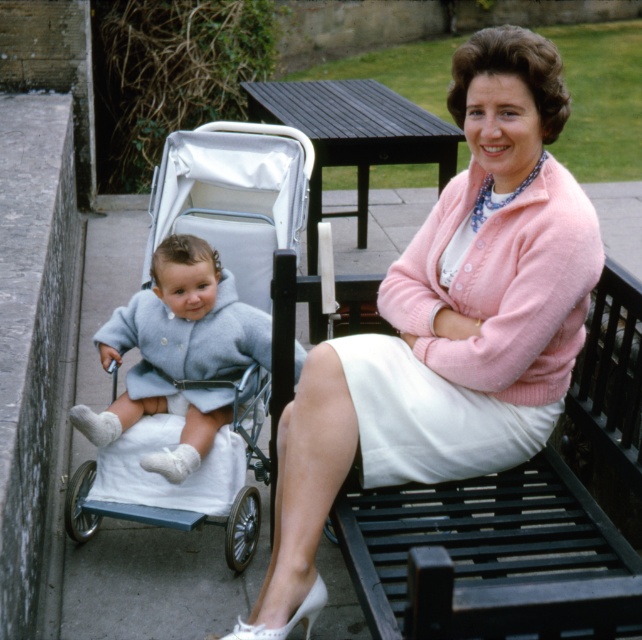
Question: Can you confirm if pink woolen cardigan at upper right is positioned to the left of black wooden bench at upper center?

Choices:
 (A) no
 (B) yes

Answer: (B)

Question: Which of these objects is positioned farthest from the white fabric skirt at center?

Choices:
 (A) black wooden bench at upper center
 (B) pink woolen cardigan at upper right
 (C) light blue fabric baby carriage at left

Answer: (C)

Question: Does light blue fabric baby carriage at left have a greater width compared to white fabric skirt at center?

Choices:
 (A) no
 (B) yes

Answer: (B)

Question: Which point is closer to the camera taking this photo?

Choices:
 (A) (525, 189)
 (B) (191, 305)

Answer: (A)

Question: Can you confirm if pink woolen cardigan at upper right is positioned below light blue fabric baby carriage at left?

Choices:
 (A) yes
 (B) no

Answer: (A)

Question: Which of these objects is positioned closest to the black wooden bench at upper center?

Choices:
 (A) white fabric skirt at center
 (B) light blue wool coat at left
 (C) pink woolen cardigan at upper right

Answer: (A)